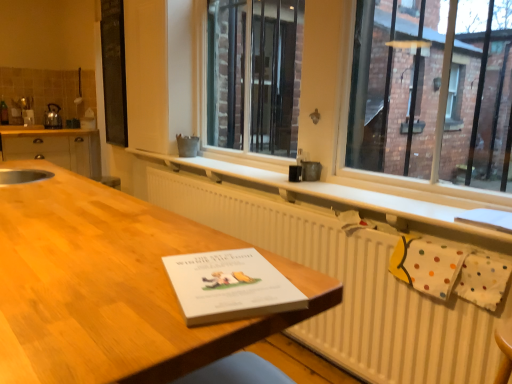
This screenshot has height=384, width=512. What do you see at coordinates (348, 286) in the screenshot? I see `white textured radiator at center` at bounding box center [348, 286].

What is the approximate height of wooden table at center?

It is 37.35 inches.

In the scene shown: What is the approximate width of clear glass window at center?

It is 6.43 inches.

This screenshot has width=512, height=384. What do you see at coordinates (114, 71) in the screenshot? I see `black matte board at upper left` at bounding box center [114, 71].

Identify the location of white paper at center. (230, 286).

Is wooden table at center directly adjacent to white matte radiator at lower center?

No, wooden table at center is not touching white matte radiator at lower center.

Is the position of wooden table at center more distant than that of white matte radiator at lower center?

No, wooden table at center is closer to the viewer.

Consider the image. Can you tell me how much wooden table at center and white matte radiator at lower center differ in facing direction?

The angular difference between wooden table at center and white matte radiator at lower center is 0.204 degrees.

From a real-world perspective, which object rests below the other?

white paper at center.

Is black matte board at upper left located outside white paper at center?

Absolutely, black matte board at upper left is external to white paper at center.

Is black matte board at upper left taller or shorter than white paper at center?

Considering their sizes, black matte board at upper left has more height than white paper at center.

Between black matte board at upper left and white paper at center, which one has smaller width?

Thinner between the two is black matte board at upper left.

Identify the location of paperback book on the right of the matte wood cabinets at left. (230, 286).

From the image's perspective, which one is positioned higher, matte wood cabinets at left or white paper at center?

matte wood cabinets at left.

Which of these two, matte wood cabinets at left or white paper at center, stands shorter?

Standing shorter between the two is white paper at center.

Is matte wood cabinets at left located outside white paper at center?

Yes.

What's the angular difference between wooden table at center and white textured radiator at center's facing directions?

The angle between the facing direction of wooden table at center and the facing direction of white textured radiator at center is 0.204 degrees.

Would you say wooden table at center is to the left or to the right of white textured radiator at center in the picture?

Clearly, wooden table at center is on the left of white textured radiator at center in the image.

Between wooden table at center and white textured radiator at center, which one has less height?

white textured radiator at center is shorter.

Is white textured radiator at center to the right of white matte radiator at lower center from the viewer's perspective?

Yes, white textured radiator at center is to the right of white matte radiator at lower center.

Is white textured radiator at center next to white matte radiator at lower center and touching it?

No.

Which point is more distant from viewer, (496, 365) or (176, 162)?

Positioned behind is point (176, 162).

Which object is further away from the camera taking this photo, white textured radiator at center or white matte radiator at lower center?

Positioned behind is white matte radiator at lower center.

Which object is positioned more to the right, black matte board at upper left or matte wood cabinets at left?

From the viewer's perspective, black matte board at upper left appears more on the right side.

Consider the image. Looking at their sizes, would you say black matte board at upper left is wider or thinner than matte wood cabinets at left?

Considering their sizes, black matte board at upper left looks slimmer than matte wood cabinets at left.

Who is smaller, black matte board at upper left or matte wood cabinets at left?

black matte board at upper left.

From the picture: Is wooden table at center closer to camera compared to white paper at center?

Yes, wooden table at center is closer to the camera.

Considering the relative sizes of wooden table at center and white paper at center in the image provided, is wooden table at center shorter than white paper at center?

No, wooden table at center is not shorter than white paper at center.

Is wooden table at center inside or outside of white paper at center?

wooden table at center cannot be found inside white paper at center.

From a real-world perspective, between wooden table at center and white paper at center, who is vertically higher?

From a 3D spatial view, white paper at center is above.

At what (x,y) coordinates should I click in order to perform the action: click on window sill behind the wooden table at center. Please return your answer as a coordinate pair (x, y). Image resolution: width=512 pixels, height=384 pixels. Looking at the image, I should click on (335, 194).

Find the location of a particular element. bulletin board above the white paper at center (from the image's perspective) is located at coordinates [114, 71].

Based on the photo, which object lies further to the anchor point wooden table at center, clear glass window at center or metallic silver kettle at left?

Based on the image, metallic silver kettle at left appears to be further to wooden table at center.

Which object lies further to the anchor point white textured radiator at center, white matte radiator at lower center or white paper at center?

Among the two, white paper at center is located further to white textured radiator at center.

Considering their positions, is clear glass window at center positioned closer to white matte radiator at lower center than black matte board at upper left?

The object closer to white matte radiator at lower center is clear glass window at center.

From the picture: Based on their spatial positions, is clear glass window at center or white matte radiator at lower center further from white paper at center?

clear glass window at center.

Consider the image. Looking at the image, which one is located further to metallic silver kettle at left, white matte radiator at lower center or black matte board at upper left?

white matte radiator at lower center lies further to metallic silver kettle at left than the other object.

From the image, which object appears to be nearer to white matte radiator at lower center, clear glass window at center or matte wood cabinets at left?

The object closer to white matte radiator at lower center is clear glass window at center.

Estimate the real-world distances between objects in this image. Which object is further from white matte radiator at lower center, metallic silver kettle at left or white paper at center?

Based on the image, metallic silver kettle at left appears to be further to white matte radiator at lower center.

Consider the image. When comparing their distances from wooden table at center, does matte wood cabinets at left or white matte radiator at lower center seem closer?

white matte radiator at lower center lies closer to wooden table at center than the other object.

Locate an element on the screen. The width and height of the screenshot is (512, 384). bulletin board between white textured radiator at center and matte wood cabinets at left along the z-axis is located at coordinates (114, 71).

The height and width of the screenshot is (384, 512). Identify the location of radiator between white paper at center and black matte board at upper left along the z-axis. (348, 286).

The image size is (512, 384). In order to click on bulletin board positioned between clear glass window at center and matte wood cabinets at left from near to far in this screenshot , I will do `click(114, 71)`.

Locate an element on the screen. The width and height of the screenshot is (512, 384). window between white paper at center and matte wood cabinets at left in the front-back direction is located at coordinates (433, 96).